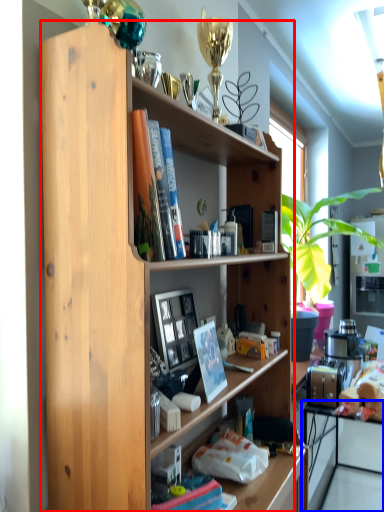
Question: Among these objects, which one is nearest to the camera, shelf (highlighted by a red box) or computer (highlighted by a blue box)?

Choices:
 (A) shelf
 (B) computer

Answer: (A)